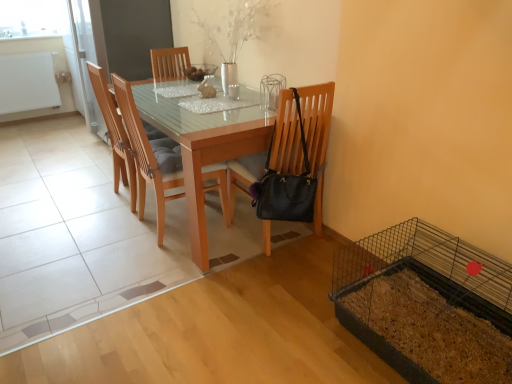
Question: Looking at their shapes, would you say light brown wood table at center is wider or thinner than wooden chair at center, marked as the 1th chair in a left-to-right arrangement?

Choices:
 (A) thin
 (B) wide

Answer: (B)

Question: Considering the positions of point (247, 130) and point (124, 165), is point (247, 130) closer or farther from the camera than point (124, 165)?

Choices:
 (A) farther
 (B) closer

Answer: (B)

Question: Estimate the real-world distances between objects in this image. Which object is closer to the wooden chair at center, acting as the second chair starting from the right?

Choices:
 (A) light brown wood table at center
 (B) black leather chair at center, acting as the 3th chair starting from the left
 (C) white matte radiator at upper left
 (D) wooden chair at center, marked as the 1th chair in a left-to-right arrangement

Answer: (D)

Question: Which object is positioned farthest from the black leather chair at center, acting as the 3th chair starting from the left?

Choices:
 (A) white matte radiator at upper left
 (B) light brown wood table at center
 (C) wooden chair at center, marked as the 1th chair in a left-to-right arrangement
 (D) wooden chair at center, acting as the second chair starting from the right

Answer: (A)